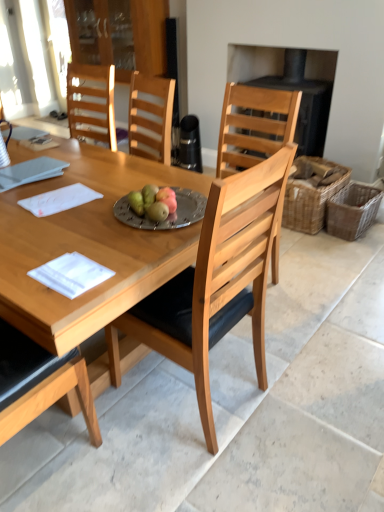
Locate an element on the screen. free point above silver metallic plate at center (from a real-world perspective) is located at coordinates (153, 210).